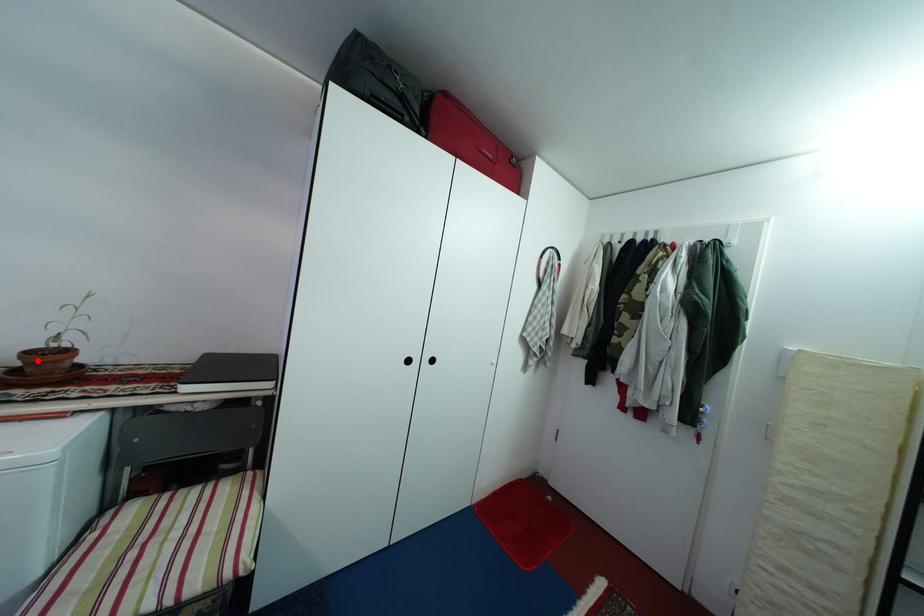
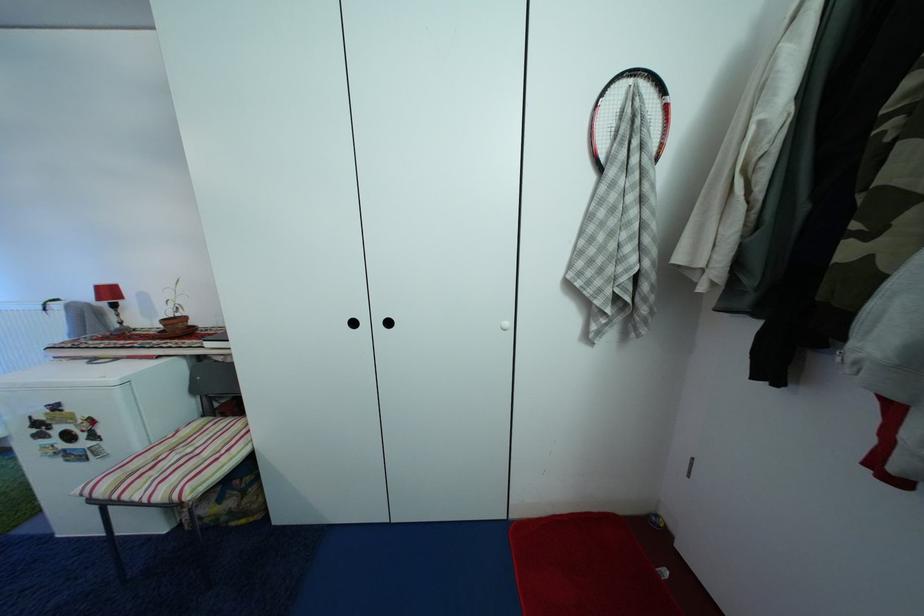
Locate, in the second image, the point that corresponds to the highlighted location in the first image.

(174, 326)